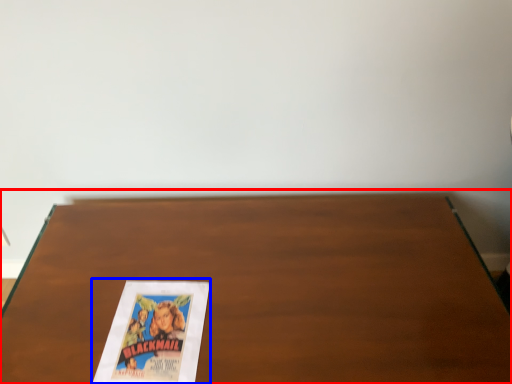
Question: Among these objects, which one is farthest to the camera, table (highlighted by a red box) or paperback book (highlighted by a blue box)?

Choices:
 (A) table
 (B) paperback book

Answer: (A)